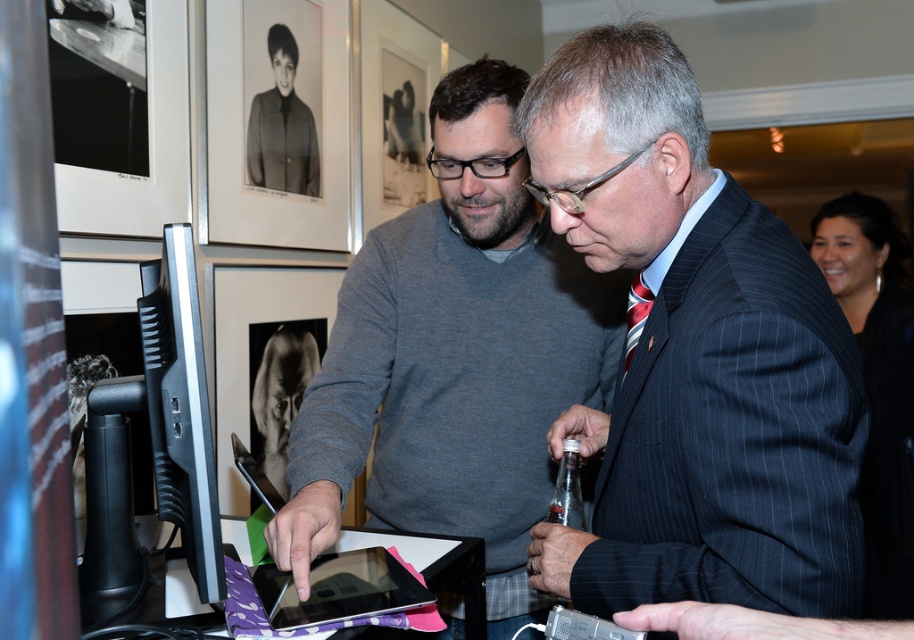
Does point (643, 534) come behind point (277, 99)?

No, (643, 534) is in front of (277, 99).

Between striped suit at center and matte black jacket at upper left, which one is positioned lower?

Positioned lower is striped suit at center.

Where is `striped suit at center`? The height and width of the screenshot is (640, 914). striped suit at center is located at coordinates (693, 356).

The height and width of the screenshot is (640, 914). I want to click on striped suit at center, so click(693, 356).

Does striped suit at center come in front of gray sweater at center?

Yes, striped suit at center is closer to the viewer.

Locate an element on the screen. The width and height of the screenshot is (914, 640). striped suit at center is located at coordinates (693, 356).

How much distance is there between gray sweater at center and black glossy tablet at center?

gray sweater at center and black glossy tablet at center are 10.61 inches apart.

Does gray sweater at center appear on the left side of black glossy tablet at center?

In fact, gray sweater at center is to the right of black glossy tablet at center.

Who is more forward, (319, 426) or (380, 598)?

Point (380, 598) is more forward.

Find the location of `gray sweater at center`. gray sweater at center is located at coordinates click(x=454, y=356).